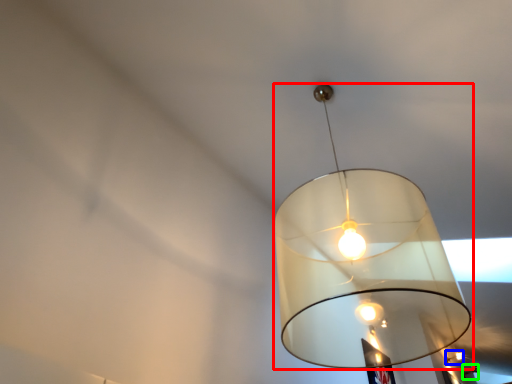
Question: Considering the real-world distances, which object is closest to lamp (highlighted by a red box)? lamp (highlighted by a blue box) or lamp (highlighted by a green box).

Choices:
 (A) lamp
 (B) lamp

Answer: (A)